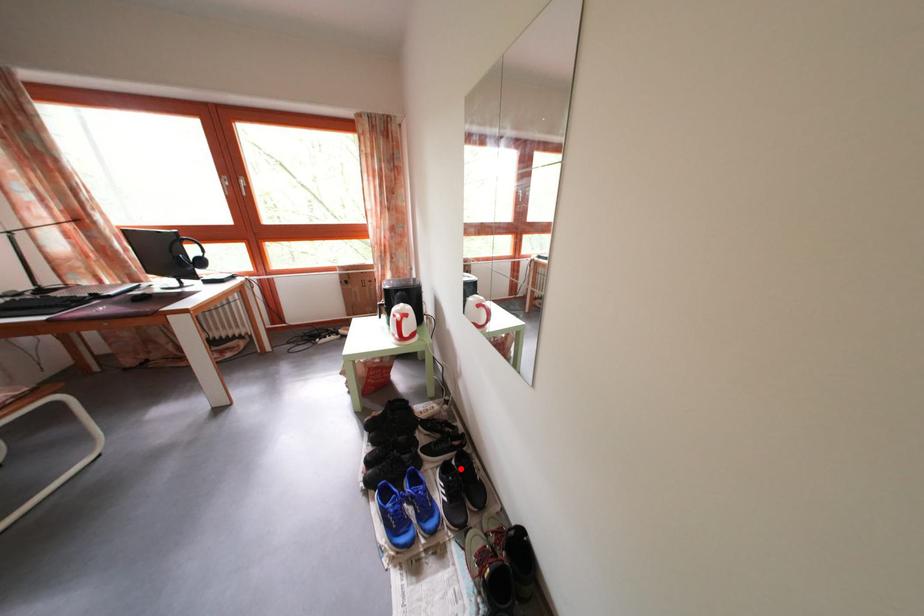
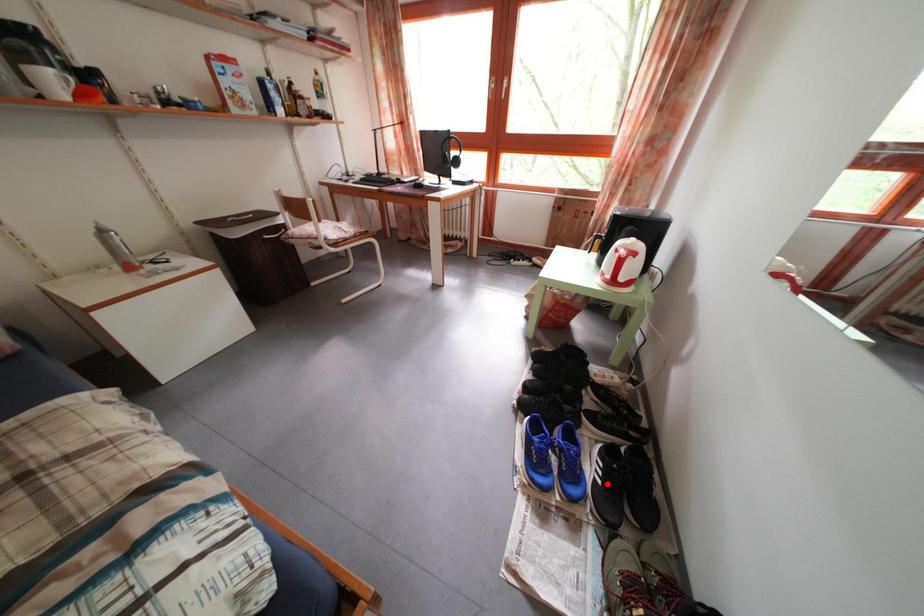
I am providing you with two images of the same scene from different viewpoints. A red point is marked on the first image and another point is marked on the second image. Is the red point in image1 aligned with the point shown in image2?

No